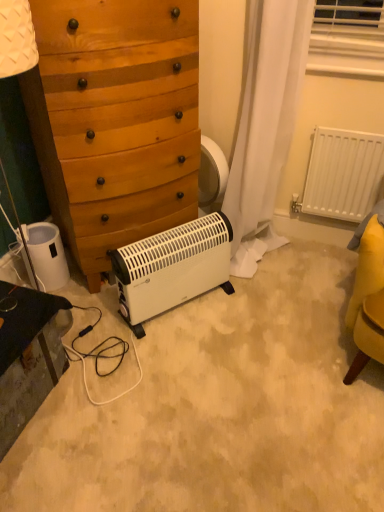
Looking at this image, measure the distance between black glossy vanity at lower left and camera.

4.13 feet.

Identify the location of white matte heater at center. click(x=172, y=268).

Is wooden chest of drawers at center facing away from white matte heater at center?

No.

Does wooden chest of drawers at center come in front of white matte heater at center?

Yes, wooden chest of drawers at center is in front of white matte heater at center.

Is black glossy vanity at lower left positioned beyond the bounds of white matte heater at center?

black glossy vanity at lower left lies outside white matte heater at center's area.

Considering the relative sizes of black glossy vanity at lower left and white matte heater at center in the image provided, is black glossy vanity at lower left taller than white matte heater at center?

No, black glossy vanity at lower left is not taller than white matte heater at center.

Can you tell me how much black glossy vanity at lower left and white matte heater at center differ in facing direction?

The angle between the facing direction of black glossy vanity at lower left and the facing direction of white matte heater at center is 36.1 degrees.

How different are the orientations of white matte heater at center and wooden chest of drawers at center in degrees?

The angular difference between white matte heater at center and wooden chest of drawers at center is 2.87 degrees.

From the image's perspective, would you say white matte heater at center is positioned over wooden chest of drawers at center?

No, from the image's perspective, white matte heater at center is not on top of wooden chest of drawers at center.

Considering the relative positions of white matte heater at center and wooden chest of drawers at center in the image provided, is white matte heater at center to the left or to the right of wooden chest of drawers at center?

From the image, it's evident that white matte heater at center is to the right of wooden chest of drawers at center.

Is white matte heater at center positioned with its back to wooden chest of drawers at center?

Yes.

From a real-world perspective, which is physically above, black glossy vanity at lower left or white plastic radiator at right?

white plastic radiator at right is physically above.

Which is behind, point (5, 347) or point (325, 143)?

The point (325, 143) is behind.

Where is `radiator above the black glossy vanity at lower left (from a real-world perspective)`? radiator above the black glossy vanity at lower left (from a real-world perspective) is located at coordinates (342, 174).

Is white plastic heater at lower left placed right next to white plastic radiator at right?

white plastic heater at lower left is not next to white plastic radiator at right, and they're not touching.

Between white plastic heater at lower left and white plastic radiator at right, which one appears on the left side from the viewer's perspective?

Positioned to the left is white plastic heater at lower left.

Considering the relative sizes of white plastic heater at lower left and white plastic radiator at right in the image provided, is white plastic heater at lower left bigger than white plastic radiator at right?

No.

Is white plastic heater at lower left inside the boundaries of white plastic radiator at right, or outside?

white plastic heater at lower left is not enclosed by white plastic radiator at right.

Between white matte heater at center and white plastic radiator at right, which one is positioned behind?

white plastic radiator at right is behind.

Would you say white matte heater at center is inside or outside white plastic radiator at right?

The correct answer is: outside.

Based on the photo, is white matte heater at center oriented towards white plastic radiator at right?

No, white matte heater at center is not turned towards white plastic radiator at right.

Which of these two, white matte heater at center or white plastic radiator at right, is smaller?

Smaller between the two is white plastic radiator at right.

In the scene shown: Is white plastic radiator at right not within black glossy vanity at lower left?

That's correct, white plastic radiator at right is outside of black glossy vanity at lower left.

Is white plastic radiator at right aimed at black glossy vanity at lower left?

No, white plastic radiator at right is not facing towards black glossy vanity at lower left.

Considering the relative sizes of white plastic radiator at right and black glossy vanity at lower left in the image provided, is white plastic radiator at right shorter than black glossy vanity at lower left?

No, white plastic radiator at right is not shorter than black glossy vanity at lower left.

Considering the positions of objects white plastic radiator at right and black glossy vanity at lower left in the image provided, who is behind, white plastic radiator at right or black glossy vanity at lower left?

white plastic radiator at right is further from the camera.

Where is `home appliance behind the wooden chest of drawers at center`? This screenshot has height=512, width=384. home appliance behind the wooden chest of drawers at center is located at coordinates (172, 268).

This screenshot has width=384, height=512. I want to click on vanity below the white matte heater at center (from the image's perspective), so click(x=27, y=355).

Based on their spatial positions, is white plastic heater at lower left or white matte heater at center further from white plastic radiator at right?

white plastic heater at lower left is positioned further to the anchor white plastic radiator at right.

From the picture: Based on their spatial positions, is white plastic radiator at right or white plastic heater at lower left further from white matte heater at center?

white plastic radiator at right is further to white matte heater at center.

In the scene shown: Which object lies nearer to the anchor point white plastic heater at lower left, white matte heater at center or black glossy vanity at lower left?

Among the two, white matte heater at center is located nearer to white plastic heater at lower left.

Which object lies nearer to the anchor point black glossy vanity at lower left, white matte heater at center or white plastic heater at lower left?

Based on the image, white matte heater at center appears to be nearer to black glossy vanity at lower left.

Based on their spatial positions, is white matte heater at center or wooden chest of drawers at center further from black glossy vanity at lower left?

The object further to black glossy vanity at lower left is wooden chest of drawers at center.

Looking at the image, which one is located further to white plastic heater at lower left, white plastic radiator at right or wooden chest of drawers at center?

Among the two, white plastic radiator at right is located further to white plastic heater at lower left.

Which object lies further to the anchor point white matte heater at center, wooden chest of drawers at center or white plastic heater at lower left?

The object further to white matte heater at center is white plastic heater at lower left.

Based on their spatial positions, is white plastic heater at lower left or white plastic radiator at right closer to black glossy vanity at lower left?

white plastic heater at lower left lies closer to black glossy vanity at lower left than the other object.

At what (x,y) coordinates should I click in order to perform the action: click on home appliance between white plastic heater at lower left and white plastic radiator at right. Please return your answer as a coordinate pair (x, y). Looking at the image, I should click on click(172, 268).

Identify the location of the chest of drawers located between black glossy vanity at lower left and white plastic radiator at right in the left-right direction. The height and width of the screenshot is (512, 384). (116, 120).

Locate an element on the screen. This screenshot has width=384, height=512. home appliance between black glossy vanity at lower left and white plastic radiator at right is located at coordinates (172, 268).

Locate an element on the screen. home appliance between wooden chest of drawers at center and white plastic radiator at right from left to right is located at coordinates (172, 268).